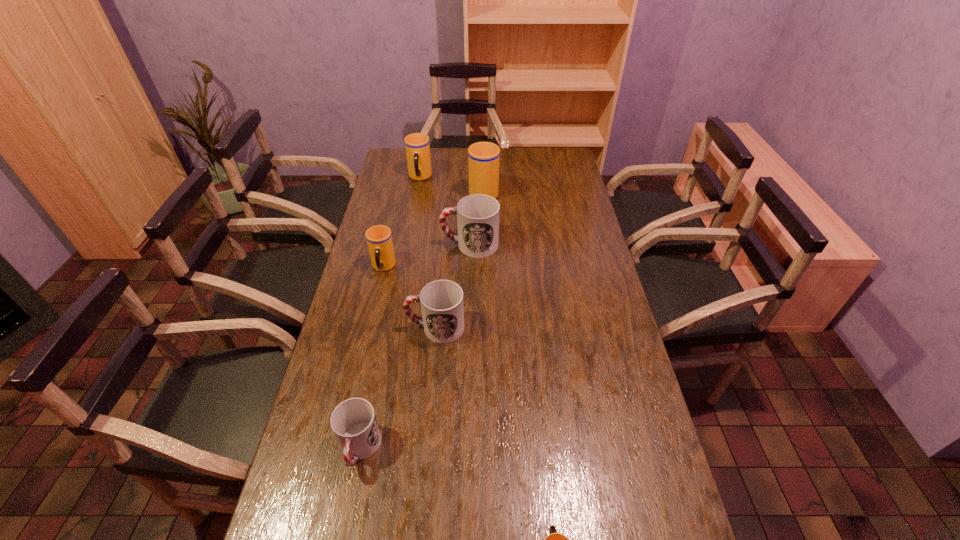
Where is `vacant space located on the handle side of the sixth farthest object`? This screenshot has width=960, height=540. vacant space located on the handle side of the sixth farthest object is located at coordinates (345, 524).

The height and width of the screenshot is (540, 960). I want to click on object at the far edge, so click(x=417, y=146).

Find the location of `object at the far left corner`. object at the far left corner is located at coordinates (417, 146).

Find the location of a particular element. The width and height of the screenshot is (960, 540). vacant space at the far edge of the desktop is located at coordinates (517, 163).

Find the location of a particular element. vacant space at the left edge of the desktop is located at coordinates (412, 187).

Locate an element on the screen. This screenshot has height=540, width=960. vacant space at the right edge of the desktop is located at coordinates (574, 202).

In the image, there is a desktop. Where is `vacant region at the far left corner`? Image resolution: width=960 pixels, height=540 pixels. vacant region at the far left corner is located at coordinates (394, 163).

In the image, there is a desktop. In order to click on vacant space at the far right corner in this screenshot , I will do `click(562, 170)`.

Locate an element on the screen. The width and height of the screenshot is (960, 540). blank region between the third biggest beige cup and the biggest red cup is located at coordinates tap(426, 256).

The image size is (960, 540). Identify the location of vacant area that lies between the second biggest beige cup and the second smallest beige cup. (401, 222).